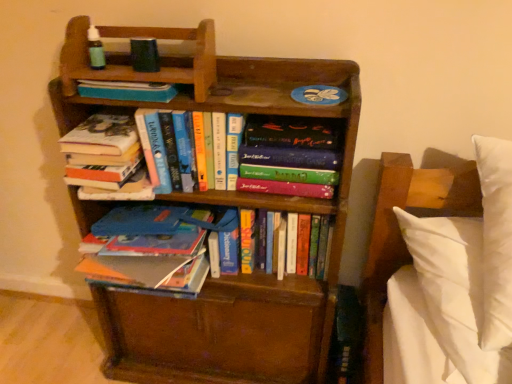
Question: Should I look upward or downward to see hardcover book at center, which appears as the fourth book when viewed from the left?

Choices:
 (A) up
 (B) down

Answer: (B)

Question: Is hardcover book at center, placed as the third book when sorted from right to left, not near wooden bookcase at center?

Choices:
 (A) yes
 (B) no

Answer: (B)

Question: Is hardcover book at center, acting as the 3th book starting from the left, outside of wooden bookcase at center?

Choices:
 (A) yes
 (B) no

Answer: (B)

Question: From a real-world perspective, is hardcover book at center, acting as the 3th book starting from the left, on wooden bookcase at center?

Choices:
 (A) yes
 (B) no

Answer: (A)

Question: Is the surface of hardcover book at center, acting as the 3th book starting from the left, in direct contact with wooden bookcase at center?

Choices:
 (A) no
 (B) yes

Answer: (A)

Question: Is hardcover book at center, placed as the third book when sorted from right to left, behind wooden bookcase at center?

Choices:
 (A) yes
 (B) no

Answer: (A)

Question: From a real-world perspective, is hardcover book at center, acting as the 3th book starting from the left, under wooden bookcase at center?

Choices:
 (A) yes
 (B) no

Answer: (B)

Question: Is hardcover book at center, which appears as the fourth book when viewed from the left, smaller than hardcover books at center, the fifth book from the right?

Choices:
 (A) no
 (B) yes

Answer: (A)

Question: Is hardcover books at center, which is the first book from left to right, located within hardcover book at center, which appears as the fourth book when viewed from the left?

Choices:
 (A) yes
 (B) no

Answer: (B)

Question: Considering the relative sizes of hardcover book at center, the 2th book positioned from the right, and hardcover books at center, the fifth book from the right, in the image provided, is hardcover book at center, the 2th book positioned from the right, thinner than hardcover books at center, the fifth book from the right,?

Choices:
 (A) no
 (B) yes

Answer: (B)

Question: From the image's perspective, is hardcover book at center, which appears as the fourth book when viewed from the left, under hardcover books at center, the fifth book from the right?

Choices:
 (A) no
 (B) yes

Answer: (B)

Question: From a real-world perspective, is hardcover book at center, the 2th book positioned from the right, positioned over hardcover books at center, which is the first book from left to right, based on gravity?

Choices:
 (A) yes
 (B) no

Answer: (B)

Question: Considering the relative positions of hardcover book at center, which appears as the fourth book when viewed from the left, and hardcover books at center, the fifth book from the right, in the image provided, is hardcover book at center, which appears as the fourth book when viewed from the left, to the right of hardcover books at center, the fifth book from the right, from the viewer's perspective?

Choices:
 (A) yes
 (B) no

Answer: (A)

Question: From the image's perspective, is hardcover book at center, acting as the 3th book starting from the left, below hardcover book at upper center, the 2th book positioned from the left?

Choices:
 (A) yes
 (B) no

Answer: (A)